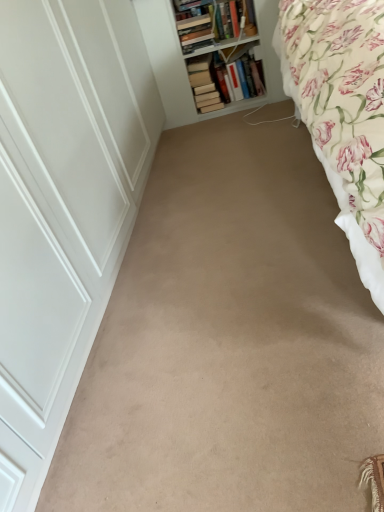
Question: Does hardcover book at upper center, the third book in the right-to-left sequence, appear on the right side of beige carpet at center?

Choices:
 (A) yes
 (B) no

Answer: (B)

Question: Is hardcover book at upper center, placed as the first book when sorted from left to right, wider than beige carpet at center?

Choices:
 (A) yes
 (B) no

Answer: (B)

Question: Is hardcover book at upper center, the third book in the right-to-left sequence, turned away from beige carpet at center?

Choices:
 (A) yes
 (B) no

Answer: (B)

Question: Considering the relative positions of hardcover book at upper center, the third book in the right-to-left sequence, and beige carpet at center in the image provided, is hardcover book at upper center, the third book in the right-to-left sequence, to the left of beige carpet at center from the viewer's perspective?

Choices:
 (A) yes
 (B) no

Answer: (A)

Question: From a real-world perspective, is hardcover book at upper center, the third book in the right-to-left sequence, beneath beige carpet at center?

Choices:
 (A) yes
 (B) no

Answer: (B)

Question: From the image's perspective, is hardcover book at upper center, the third book in the right-to-left sequence, positioned above or below white wooden bookshelf at upper center?

Choices:
 (A) above
 (B) below

Answer: (A)

Question: Is hardcover book at upper center, the third book in the right-to-left sequence, bigger or smaller than white wooden bookshelf at upper center?

Choices:
 (A) big
 (B) small

Answer: (B)

Question: Considering the positions of point tap(205, 19) and point tap(220, 79), is point tap(205, 19) closer or farther from the camera than point tap(220, 79)?

Choices:
 (A) closer
 (B) farther

Answer: (A)

Question: Is hardcover book at upper center, placed as the first book when sorted from left to right, wider or thinner than white wooden bookshelf at upper center?

Choices:
 (A) thin
 (B) wide

Answer: (A)

Question: In the image, is beige carpet at center on the left side or the right side of hardcover book at upper center, the 3th book in the left-to-right sequence?

Choices:
 (A) left
 (B) right

Answer: (A)

Question: From their relative heights in the image, would you say beige carpet at center is taller or shorter than hardcover book at upper center, the 3th book in the left-to-right sequence?

Choices:
 (A) tall
 (B) short

Answer: (B)

Question: From a real-world perspective, relative to hardcover book at upper center, the 3th book in the left-to-right sequence, is beige carpet at center vertically above or below?

Choices:
 (A) above
 (B) below

Answer: (B)

Question: Looking at their shapes, would you say beige carpet at center is wider or thinner than hardcover book at upper center, which appears as the first book when viewed from the right?

Choices:
 (A) wide
 (B) thin

Answer: (A)

Question: Is hardcover book at upper center, placed as the first book when sorted from left to right, inside or outside of beige carpet at center?

Choices:
 (A) inside
 (B) outside

Answer: (B)

Question: From a real-world perspective, relative to beige carpet at center, is hardcover book at upper center, the third book in the right-to-left sequence, vertically above or below?

Choices:
 (A) below
 (B) above

Answer: (B)